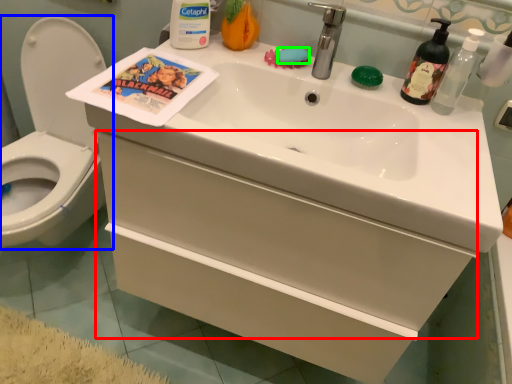
Question: Which object is positioned farthest from drawer (highlighted by a red box)? Select from toilet (highlighted by a blue box) and soap (highlighted by a green box).

Choices:
 (A) toilet
 (B) soap

Answer: (A)